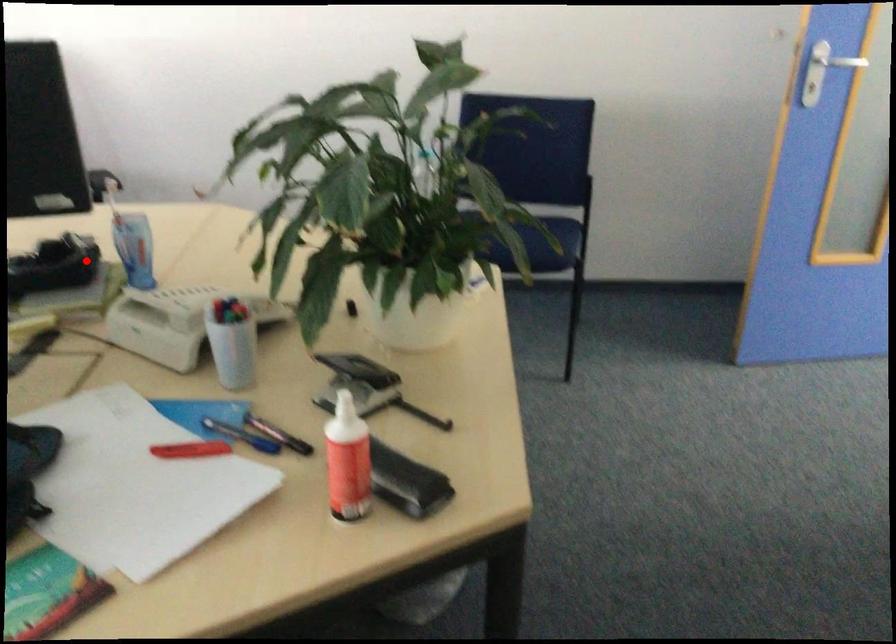
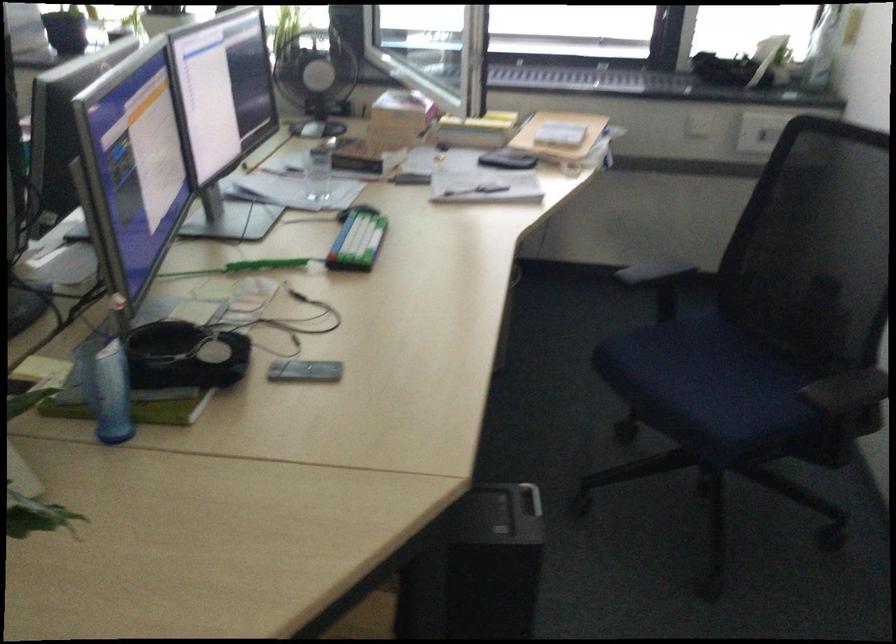
Where in the second image is the point corresponding to the highlighted location from the first image?

(110, 393)